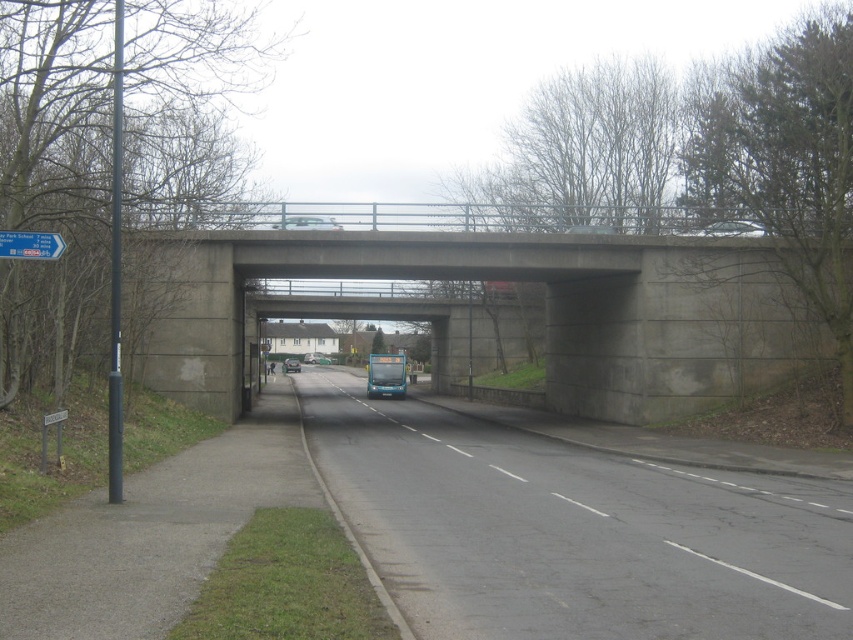
Which is in front, point (329, 225) or point (286, 364)?

Point (329, 225) is more forward.

Which is behind, point (302, 216) or point (293, 358)?

The point (293, 358) is more distant.

Does point (305, 225) come behind point (285, 369)?

That is False.

Locate an element on the screen. silver metallic car at center is located at coordinates (306, 221).

Between black asphalt highway at center and concrete bridge at center, which one has less height?

black asphalt highway at center is shorter.

Is point (587, 480) behind point (653, 307)?

That is False.

Which is in front, point (396, 582) or point (724, 381)?

Point (396, 582) is in front.

Locate an element on the screen. This screenshot has height=640, width=853. black asphalt highway at center is located at coordinates (572, 531).

Who is shorter, concrete bridge at center or metallic silver car at center?

metallic silver car at center

This screenshot has height=640, width=853. What do you see at coordinates (544, 316) in the screenshot?
I see `concrete bridge at center` at bounding box center [544, 316].

This screenshot has height=640, width=853. Find the location of `concrete bridge at center`. concrete bridge at center is located at coordinates (544, 316).